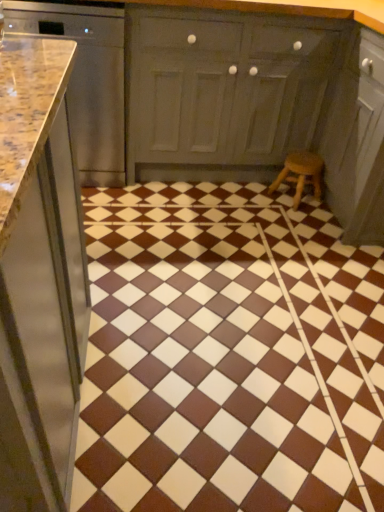
Question: Is wooden stool at lower right with brown glossy tile at center?

Choices:
 (A) yes
 (B) no

Answer: (B)

Question: From the image's perspective, is wooden stool at lower right over brown glossy tile at center?

Choices:
 (A) no
 (B) yes

Answer: (B)

Question: Considering the relative positions of wooden stool at lower right and brown glossy tile at center in the image provided, is wooden stool at lower right to the right of brown glossy tile at center from the viewer's perspective?

Choices:
 (A) no
 (B) yes

Answer: (B)

Question: From a real-world perspective, is wooden stool at lower right positioned under brown glossy tile at center based on gravity?

Choices:
 (A) no
 (B) yes

Answer: (A)

Question: Considering the relative sizes of wooden stool at lower right and brown glossy tile at center in the image provided, is wooden stool at lower right taller than brown glossy tile at center?

Choices:
 (A) no
 (B) yes

Answer: (B)

Question: From a real-world perspective, does wooden stool at lower right stand above brown glossy tile at center?

Choices:
 (A) yes
 (B) no

Answer: (A)

Question: Does polished granite countertop at left, arranged as the 2th cabinetry when viewed from the right, have a greater width compared to wooden stool at lower right?

Choices:
 (A) yes
 (B) no

Answer: (A)

Question: Is polished granite countertop at left, arranged as the 2th cabinetry when viewed from the right, positioned with its back to wooden stool at lower right?

Choices:
 (A) no
 (B) yes

Answer: (A)

Question: Does polished granite countertop at left, acting as the first cabinetry starting from the left, have a larger size compared to wooden stool at lower right?

Choices:
 (A) yes
 (B) no

Answer: (A)

Question: Is polished granite countertop at left, arranged as the 2th cabinetry when viewed from the right, not near wooden stool at lower right?

Choices:
 (A) no
 (B) yes

Answer: (B)

Question: From the image's perspective, would you say polished granite countertop at left, acting as the first cabinetry starting from the left, is positioned over wooden stool at lower right?

Choices:
 (A) yes
 (B) no

Answer: (A)

Question: Does polished granite countertop at left, arranged as the 2th cabinetry when viewed from the right, come in front of wooden stool at lower right?

Choices:
 (A) no
 (B) yes

Answer: (B)

Question: Considering the relative positions of brown glossy tile at center and matte gray cabinet at center, marked as the first cabinetry in a right-to-left arrangement, in the image provided, is brown glossy tile at center to the left of matte gray cabinet at center, marked as the first cabinetry in a right-to-left arrangement, from the viewer's perspective?

Choices:
 (A) yes
 (B) no

Answer: (B)